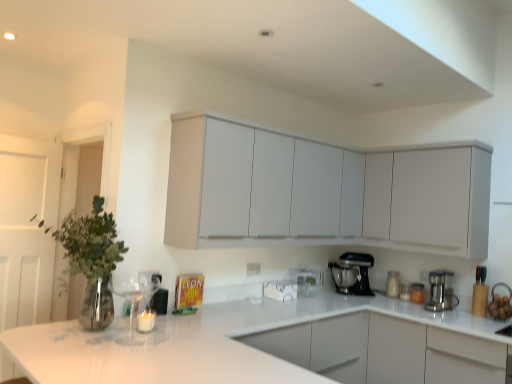
The image size is (512, 384). I want to click on white matte cabinet at upper right, acting as the second cabinetry starting from the left, so click(442, 198).

What do you see at coordinates (393, 284) in the screenshot? I see `white glossy jar at lower right` at bounding box center [393, 284].

The width and height of the screenshot is (512, 384). Identify the location of satin silver coffee maker at right, the first kitchen appliance positioned from the front. (440, 292).

Measure the distance between point (x=501, y=381) and camera.

Point (x=501, y=381) and camera are 8.39 feet apart from each other.

You are a GUI agent. You are given a task and a screenshot of the screen. Output one action in this format:
    pyautogui.click(x=<x>, y=<y>)
    Task: Click on the white glossy sink at lower right
    
    Given the screenshot: What is the action you would take?
    pyautogui.click(x=500, y=304)

Is white wooden door at left placed right next to black metallic stand mixer at lower center, the second kitchen appliance from the front?

They are not placed beside each other.

Find the location of `glass door to the left of black metallic stand mixer at lower center, which ranks as the first kitchen appliance in left-to-right order`. glass door to the left of black metallic stand mixer at lower center, which ranks as the first kitchen appliance in left-to-right order is located at coordinates (27, 229).

From the image's perspective, between white wooden door at left and black metallic stand mixer at lower center, which is counted as the 1th kitchen appliance, starting from the back, who is located below?

black metallic stand mixer at lower center, which is counted as the 1th kitchen appliance, starting from the back, appears lower in the image.

Does white wooden door at left have a larger size compared to black metallic stand mixer at lower center, which ranks as the first kitchen appliance in left-to-right order?

Yes, white wooden door at left is bigger than black metallic stand mixer at lower center, which ranks as the first kitchen appliance in left-to-right order.

Which is behind, point (42, 207) or point (451, 301)?

The point (451, 301) is farther from the camera.

There is a white wooden door at left. At what (x,y) coordinates should I click in order to perform the action: click on the 2nd kitchen appliance below it (from a real-world perspective). Please return your answer as a coordinate pair (x, y). The height and width of the screenshot is (384, 512). Looking at the image, I should click on (440, 292).

Does white wooden door at left turn towards satin silver coffee maker at right, which appears as the 2th kitchen appliance when viewed from the left?

No, white wooden door at left is not aimed at satin silver coffee maker at right, which appears as the 2th kitchen appliance when viewed from the left.

Considering the relative sizes of white wooden door at left and satin silver coffee maker at right, which appears as the 2th kitchen appliance when viewed from the left, in the image provided, is white wooden door at left taller than satin silver coffee maker at right, which appears as the 2th kitchen appliance when viewed from the left,?

Correct, white wooden door at left is much taller as satin silver coffee maker at right, which appears as the 2th kitchen appliance when viewed from the left.

Can you tell me how much white glossy jar at lower right and matte white cabinets at upper center, placed as the 1th cabinetry when sorted from left to right, differ in facing direction?

white glossy jar at lower right and matte white cabinets at upper center, placed as the 1th cabinetry when sorted from left to right, are facing 86.3 degrees away from each other.

Between white glossy jar at lower right and matte white cabinets at upper center, the second cabinetry from the right, which one has less height?

Standing shorter between the two is white glossy jar at lower right.

Is white glossy jar at lower right turned away from matte white cabinets at upper center, placed as the 1th cabinetry when sorted from left to right?

No.

Is point (389, 281) positioned before point (436, 182)?

No, (389, 281) is behind (436, 182).

Would you say black metallic stand mixer at lower center, which appears as the 2th kitchen appliance when viewed from the right, contains satin silver coffee maker at right, the first kitchen appliance positioned from the front?

No, satin silver coffee maker at right, the first kitchen appliance positioned from the front, is not surrounded by black metallic stand mixer at lower center, which appears as the 2th kitchen appliance when viewed from the right.

Looking at this image, considering the relative sizes of black metallic stand mixer at lower center, which appears as the 2th kitchen appliance when viewed from the right, and satin silver coffee maker at right, which appears as the 2th kitchen appliance when viewed from the left, in the image provided, is black metallic stand mixer at lower center, which appears as the 2th kitchen appliance when viewed from the right, shorter than satin silver coffee maker at right, which appears as the 2th kitchen appliance when viewed from the left,?

No.

In the scene shown: Is black metallic stand mixer at lower center, the second kitchen appliance from the front, to the right of satin silver coffee maker at right, the second kitchen appliance from the back, from the viewer's perspective?

No, black metallic stand mixer at lower center, the second kitchen appliance from the front, is not to the right of satin silver coffee maker at right, the second kitchen appliance from the back.

Identify the location of kitchen appliance that appears above the satin silver coffee maker at right, the first kitchen appliance positioned from the front (from the image's perspective). (352, 273).

Is satin silver coffee maker at right, the first kitchen appliance positioned from the front, in contact with white glossy jar at lower right?

satin silver coffee maker at right, the first kitchen appliance positioned from the front, and white glossy jar at lower right are clearly separated.

Which of these two, satin silver coffee maker at right, which appears as the 2th kitchen appliance when viewed from the left, or white glossy jar at lower right, is thinner?

With smaller width is white glossy jar at lower right.

Is satin silver coffee maker at right, placed as the first kitchen appliance when sorted from right to left, surrounding white glossy jar at lower right?

No, white glossy jar at lower right is not a part of satin silver coffee maker at right, placed as the first kitchen appliance when sorted from right to left.

Which is farther from the camera, (425, 304) or (396, 279)?

Positioned behind is point (396, 279).

Does white wooden door at left have a greater height compared to white matte cabinet at upper right, acting as the second cabinetry starting from the left?

Yes, white wooden door at left is taller than white matte cabinet at upper right, acting as the second cabinetry starting from the left.

Considering the relative sizes of white wooden door at left and white matte cabinet at upper right, acting as the second cabinetry starting from the left, in the image provided, is white wooden door at left smaller than white matte cabinet at upper right, acting as the second cabinetry starting from the left,?

Yes, white wooden door at left is smaller than white matte cabinet at upper right, acting as the second cabinetry starting from the left.

Based on the photo, could you measure the distance between white wooden door at left and white matte cabinet at upper right, acting as the second cabinetry starting from the left?

white wooden door at left is 9.30 feet from white matte cabinet at upper right, acting as the second cabinetry starting from the left.

Would you say white wooden door at left is outside white matte cabinet at upper right, acting as the second cabinetry starting from the left?

white wooden door at left lies outside white matte cabinet at upper right, acting as the second cabinetry starting from the left,'s area.

From the image's perspective, is matte white cabinets at upper center, placed as the 1th cabinetry when sorted from left to right, above or below black metallic stand mixer at lower center, which appears as the 2th kitchen appliance when viewed from the right?

Clearly, from the image's perspective, matte white cabinets at upper center, placed as the 1th cabinetry when sorted from left to right, is above black metallic stand mixer at lower center, which appears as the 2th kitchen appliance when viewed from the right.

Based on their positions, is matte white cabinets at upper center, the second cabinetry from the right, located to the left or right of black metallic stand mixer at lower center, which ranks as the first kitchen appliance in left-to-right order?

matte white cabinets at upper center, the second cabinetry from the right, is positioned on black metallic stand mixer at lower center, which ranks as the first kitchen appliance in left-to-right order,'s left side.

Do you think matte white cabinets at upper center, placed as the 1th cabinetry when sorted from left to right, is within black metallic stand mixer at lower center, the second kitchen appliance from the front, or outside of it?

matte white cabinets at upper center, placed as the 1th cabinetry when sorted from left to right, cannot be found inside black metallic stand mixer at lower center, the second kitchen appliance from the front.

What are the coordinates of `cabinetry that is the 1st one above the black metallic stand mixer at lower center, which appears as the 2th kitchen appliance when viewed from the right (from a real-world perspective)` in the screenshot? It's located at (320, 192).

At what (x,y) coordinates should I click in order to perform the action: click on glass door that is on the left side of black metallic stand mixer at lower center, the second kitchen appliance from the front. Please return your answer as a coordinate pair (x, y). The height and width of the screenshot is (384, 512). Looking at the image, I should click on (27, 229).

I want to click on glass door that is in front of the satin silver coffee maker at right, the first kitchen appliance positioned from the front, so click(27, 229).

Looking at this image, from the image, which object appears to be nearer to white matte cabinet at upper right, acting as the second cabinetry starting from the left, white glossy sink at lower right or white glossy jar at lower right?

white glossy sink at lower right is closer to white matte cabinet at upper right, acting as the second cabinetry starting from the left.

When comparing their distances from satin silver coffee maker at right, the first kitchen appliance positioned from the front, does white wooden door at left or black metallic stand mixer at lower center, which is counted as the 1th kitchen appliance, starting from the back, seem closer?

Among the two, black metallic stand mixer at lower center, which is counted as the 1th kitchen appliance, starting from the back, is located nearer to satin silver coffee maker at right, the first kitchen appliance positioned from the front.

Based on their spatial positions, is satin silver coffee maker at right, placed as the first kitchen appliance when sorted from right to left, or matte white cabinets at upper center, placed as the 1th cabinetry when sorted from left to right, further from white glossy countertop at center?

satin silver coffee maker at right, placed as the first kitchen appliance when sorted from right to left, is further to white glossy countertop at center.

Consider the image. Looking at the image, which one is located further to satin silver coffee maker at right, placed as the first kitchen appliance when sorted from right to left, white glossy countertop at center or white matte cabinet at upper right, acting as the second cabinetry starting from the left?

The object further to satin silver coffee maker at right, placed as the first kitchen appliance when sorted from right to left, is white glossy countertop at center.

Estimate the real-world distances between objects in this image. Which object is closer to white glossy jar at lower right, matte white cabinets at upper center, placed as the 1th cabinetry when sorted from left to right, or white glossy sink at lower right?

Based on the image, white glossy sink at lower right appears to be nearer to white glossy jar at lower right.

Looking at the image, which one is located further to white glossy countertop at center, white glossy sink at lower right or white matte cabinet at upper right, acting as the second cabinetry starting from the left?

white glossy sink at lower right lies further to white glossy countertop at center than the other object.

When comparing their distances from white glossy sink at lower right, does matte white cabinets at upper center, placed as the 1th cabinetry when sorted from left to right, or white wooden door at left seem closer?

matte white cabinets at upper center, placed as the 1th cabinetry when sorted from left to right, lies closer to white glossy sink at lower right than the other object.

Which object lies nearer to the anchor point white matte cabinet at upper right, acting as the second cabinetry starting from the left, black metallic stand mixer at lower center, which is counted as the 1th kitchen appliance, starting from the back, or white wooden door at left?

The object closer to white matte cabinet at upper right, acting as the second cabinetry starting from the left, is black metallic stand mixer at lower center, which is counted as the 1th kitchen appliance, starting from the back.

Where is `cabinetry between white wooden door at left and white glossy jar at lower right from left to right`? The width and height of the screenshot is (512, 384). cabinetry between white wooden door at left and white glossy jar at lower right from left to right is located at coordinates (320, 192).

The width and height of the screenshot is (512, 384). Find the location of `cabinetry between white glossy countertop at center and white glossy sink at lower right from front to back`. cabinetry between white glossy countertop at center and white glossy sink at lower right from front to back is located at coordinates (320, 192).

Where is `appliance between white wooden door at left and satin silver coffee maker at right, which appears as the 2th kitchen appliance when viewed from the left`? This screenshot has width=512, height=384. appliance between white wooden door at left and satin silver coffee maker at right, which appears as the 2th kitchen appliance when viewed from the left is located at coordinates (393, 284).

Where is `sink located between white glossy countertop at center and white glossy jar at lower right in the depth direction`? sink located between white glossy countertop at center and white glossy jar at lower right in the depth direction is located at coordinates (500, 304).